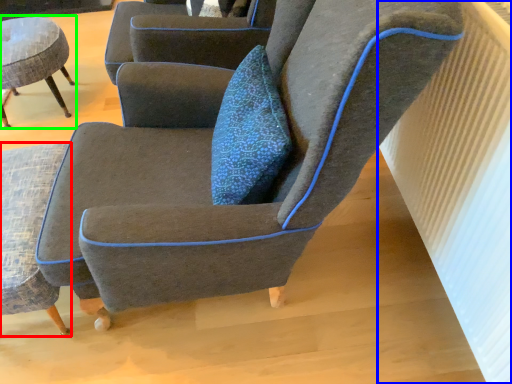
Question: Estimate the real-world distances between objects in this image. Which object is farther from chair (highlighted by a red box), radiator (highlighted by a blue box) or chair (highlighted by a green box)?

Choices:
 (A) radiator
 (B) chair

Answer: (A)